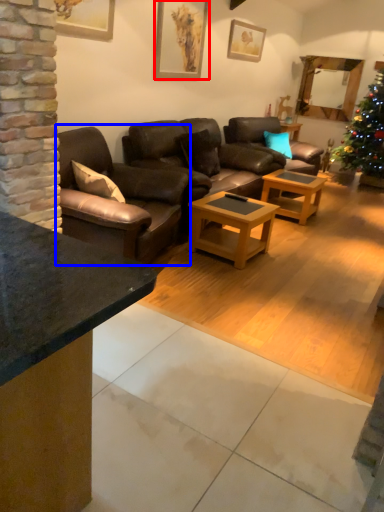
Question: Among these objects, which one is nearest to the camera, picture frame (highlighted by a red box) or studio couch (highlighted by a blue box)?

Choices:
 (A) picture frame
 (B) studio couch

Answer: (B)